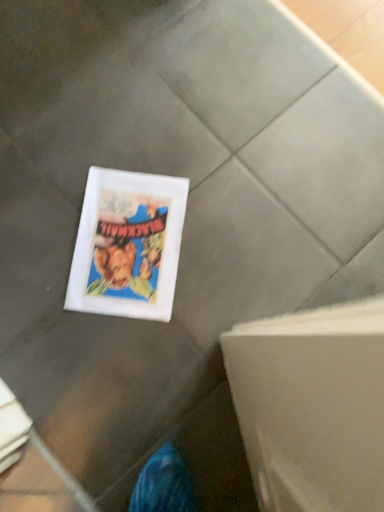
Locate an element on the screen. Image resolution: width=384 pixels, height=512 pixels. empty space that is ontop of white matte paper at center is located at coordinates (129, 242).